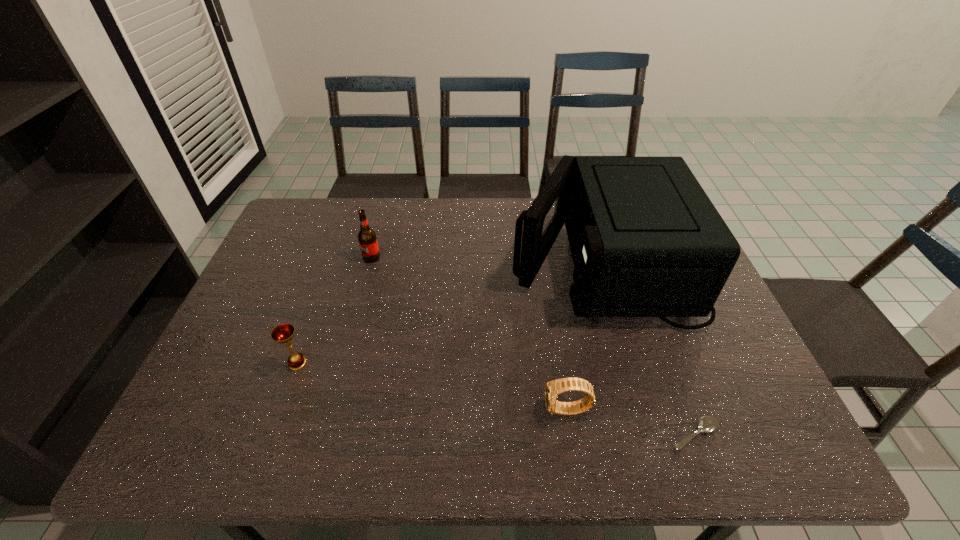
Image resolution: width=960 pixels, height=540 pixels. I want to click on soupspoon situated at the right edge, so click(707, 424).

Find the location of a particular element. object present at the far right corner is located at coordinates (646, 241).

Where is `object positioned at the near right corner`? object positioned at the near right corner is located at coordinates (707, 424).

Locate an element on the screen. free space at the far edge of the desktop is located at coordinates (394, 214).

Where is `vacant space at the near edge of the desktop`? vacant space at the near edge of the desktop is located at coordinates (394, 443).

Find the location of a particular element. This screenshot has height=540, width=960. free space at the left edge is located at coordinates pyautogui.click(x=273, y=344).

Identify the location of vacant area at the right edge. (679, 329).

This screenshot has height=540, width=960. Find the location of `vacant space at the near right corner`. vacant space at the near right corner is located at coordinates (735, 457).

Locate an element on the screen. This screenshot has height=540, width=960. free space that is in between the leftmost object and the fourth shortest object is located at coordinates (334, 310).

The width and height of the screenshot is (960, 540). I want to click on vacant space that's between the fourth shortest object and the second shortest object, so click(x=469, y=334).